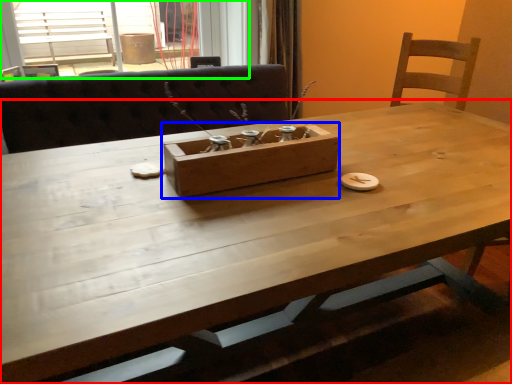
Question: Considering the real-world distances, which object is closest to table (highlighted by a red box)? cardboard box (highlighted by a blue box) or window (highlighted by a green box).

Choices:
 (A) cardboard box
 (B) window

Answer: (A)